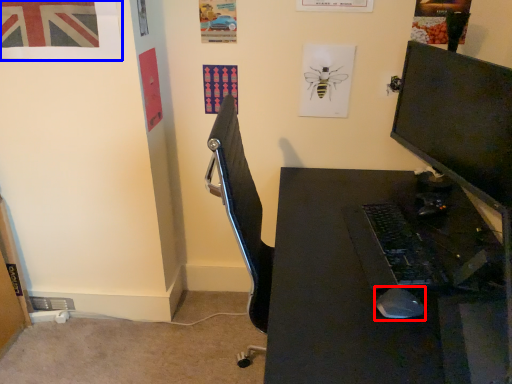
Question: Which point is further to the camera, mouse (highlighted by a red box) or poster page (highlighted by a blue box)?

Choices:
 (A) mouse
 (B) poster page

Answer: (B)